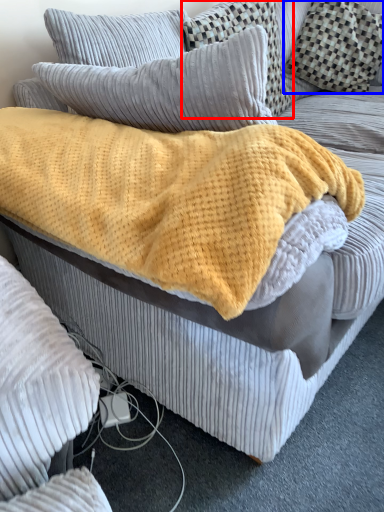
Question: Among these objects, which one is nearest to the camera, pillow (highlighted by a red box) or pillow (highlighted by a blue box)?

Choices:
 (A) pillow
 (B) pillow

Answer: (A)